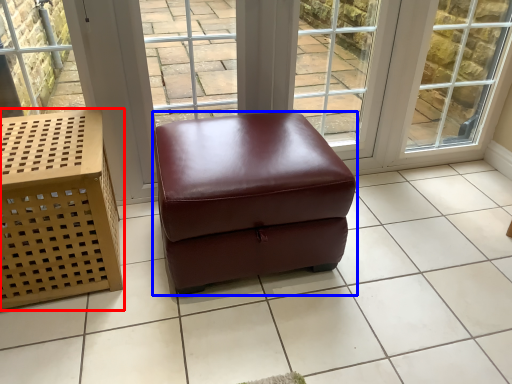
Question: Which of the following is the farthest to the observer, furniture (highlighted by a red box) or stool (highlighted by a blue box)?

Choices:
 (A) furniture
 (B) stool

Answer: (B)